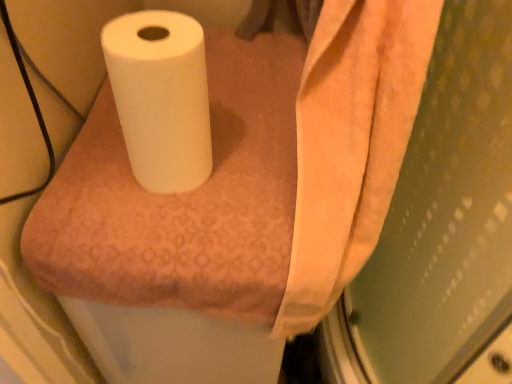
In order to click on vacant space situated above white matte paper towel at center (from a real-world perspective) in this screenshot , I will do `click(214, 139)`.